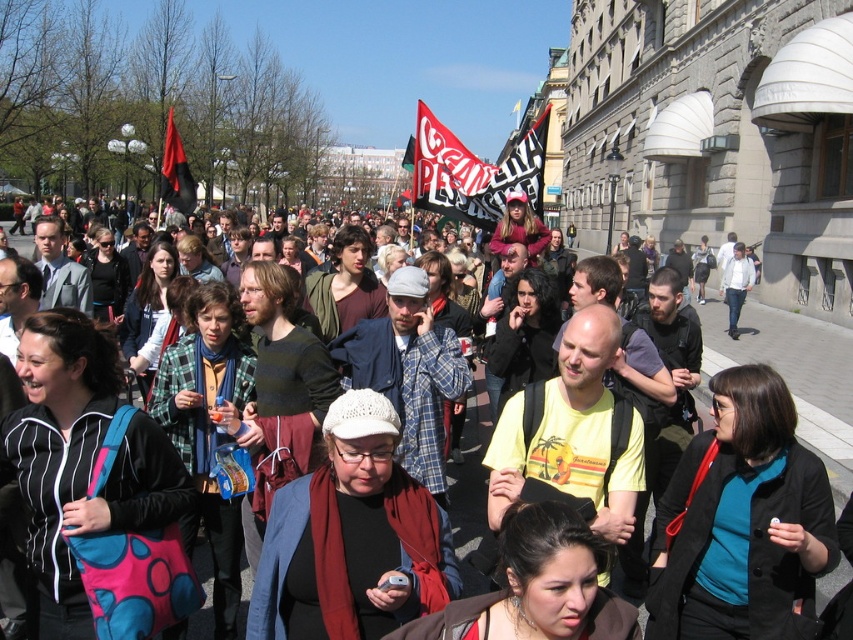
Who is shorter, matte black backpack at center or red and white fabric flag at center?

red and white fabric flag at center is shorter.

Describe the element at coordinates (469, 474) in the screenshot. This screenshot has width=853, height=640. I see `matte black backpack at center` at that location.

Does point (460, 550) come behind point (434, 141)?

No, (460, 550) is closer to viewer.

Find the location of a particular element. This screenshot has width=853, height=640. matte black backpack at center is located at coordinates (469, 474).

Is matte black backpack at center further to the viewer compared to black fabric flag at upper left?

No, matte black backpack at center is closer to the viewer.

Is point (483, 442) positioned in front of point (171, 124)?

Yes, it is in front of point (171, 124).

Describe the element at coordinates (469, 474) in the screenshot. I see `matte black backpack at center` at that location.

This screenshot has height=640, width=853. I want to click on matte black backpack at center, so click(469, 474).

Between red and white fabric flag at center and black fabric flag at upper left, which one is positioned lower?

red and white fabric flag at center is lower down.

Does red and white fabric flag at center have a larger size compared to black fabric flag at upper left?

Actually, red and white fabric flag at center might be smaller than black fabric flag at upper left.

At what (x,y) coordinates should I click in order to perform the action: click on red and white fabric flag at center. Please return your answer as a coordinate pair (x, y). The image size is (853, 640). Looking at the image, I should click on (444, 164).